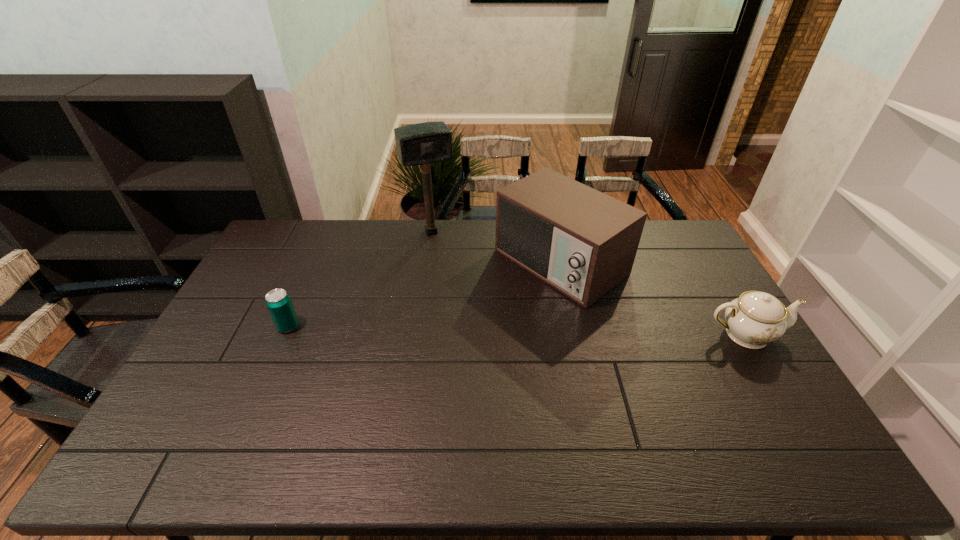
Find the location of a particular element. This screenshot has width=960, height=540. free spot between the chinaware and the radio receiver is located at coordinates (653, 298).

Locate an element on the screen. This screenshot has height=540, width=960. vacant region between the shortest object and the rightmost object is located at coordinates (516, 330).

What are the coordinates of `object that is the third closest to the second shortest object` in the screenshot? It's located at (278, 302).

This screenshot has width=960, height=540. I want to click on object that is the second nearest to the leftmost object, so click(x=582, y=242).

Identify the location of vacant region that satisfies the following two spatial constraints: 1. on the front side of the third tallest object; 2. at the spout of the second object from right to left. (576, 334).

Find the location of a particular element. This screenshot has height=540, width=960. vacant region that satisfies the following two spatial constraints: 1. on the back side of the second object from right to left; 2. on the left side of the shortest object is located at coordinates (317, 262).

Find the location of `free region that satisfies the following two spatial constraints: 1. on the front side of the second shortest object; 2. at the spout of the tallest object`. free region that satisfies the following two spatial constraints: 1. on the front side of the second shortest object; 2. at the spout of the tallest object is located at coordinates (417, 334).

Find the location of `blank area in the image that satisfies the following two spatial constraints: 1. on the back side of the third shortest object; 2. on the left side of the shortest object`. blank area in the image that satisfies the following two spatial constraints: 1. on the back side of the third shortest object; 2. on the left side of the shortest object is located at coordinates (317, 262).

I want to click on free space that satisfies the following two spatial constraints: 1. on the front side of the third shortest object; 2. at the spout of the rightmost object, so click(x=576, y=334).

Locate an element on the screen. free space that satisfies the following two spatial constraints: 1. on the front side of the tallest object; 2. on the left side of the second object from right to left is located at coordinates (427, 262).